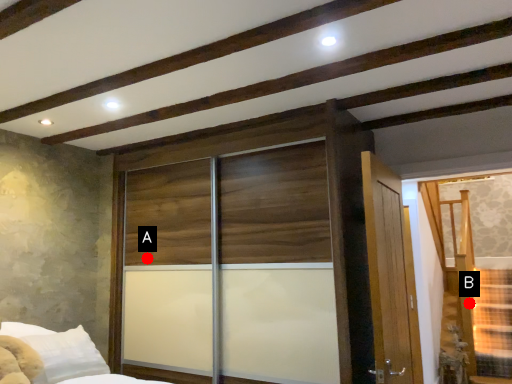
Question: Two points are circled on the image, labeled by A and B beside each circle. Which point is closer to the camera taking this photo?

Choices:
 (A) A is closer
 (B) B is closer

Answer: (A)